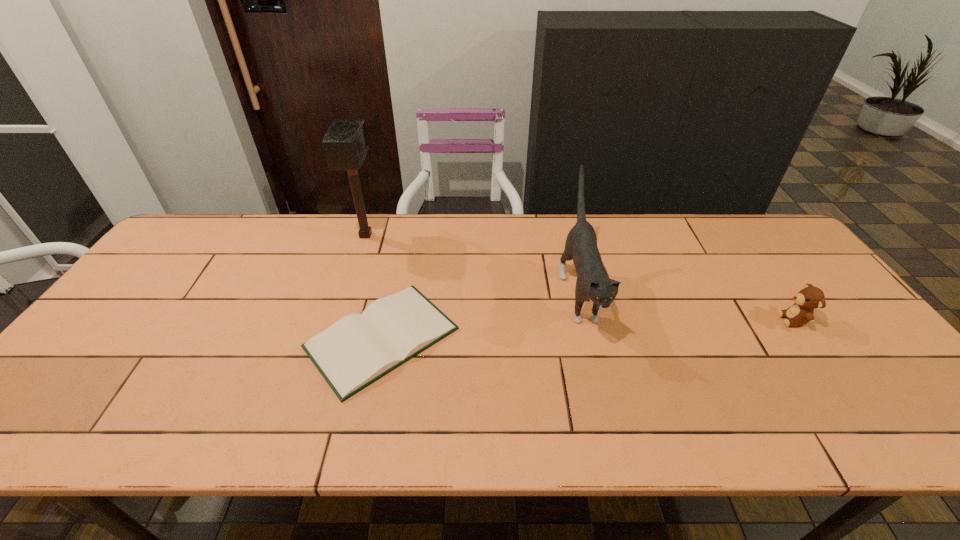
Where is `free location located 0.250m on the face of the teddy bear`? The image size is (960, 540). free location located 0.250m on the face of the teddy bear is located at coordinates (685, 320).

You are a GUI agent. You are given a task and a screenshot of the screen. Output one action in this format:
    pyautogui.click(x=<x>, y=<y>)
    Task: Click on the vacant space located on the back of the shortest object
    The image size is (960, 540).
    Given the screenshot: What is the action you would take?
    pyautogui.click(x=396, y=273)

At what (x,y) coordinates should I click in order to perform the action: click on mallet present at the far edge. Please return your answer as a coordinate pair (x, y). The image size is (960, 540). Looking at the image, I should click on (345, 143).

Locate an element on the screen. cat situated at the far edge is located at coordinates (593, 284).

This screenshot has height=540, width=960. Find the location of `object located in the right edge section of the desktop`. object located in the right edge section of the desktop is located at coordinates (806, 300).

This screenshot has height=540, width=960. What are the coordinates of `vacant area at the far edge` in the screenshot? It's located at (577, 219).

Identify the location of blank space at the near edge. (282, 433).

Identify the location of free point at the near right corner. This screenshot has height=540, width=960. (875, 414).

Find the location of a particular element. The width and height of the screenshot is (960, 540). empty space that is in between the third tallest object and the hardback book is located at coordinates (588, 329).

At what (x,y) coordinates should I click in order to perform the action: click on vacant region between the mallet and the second object from right to left. Please return your answer as a coordinate pair (x, y). The image size is (960, 540). Looking at the image, I should click on (472, 264).